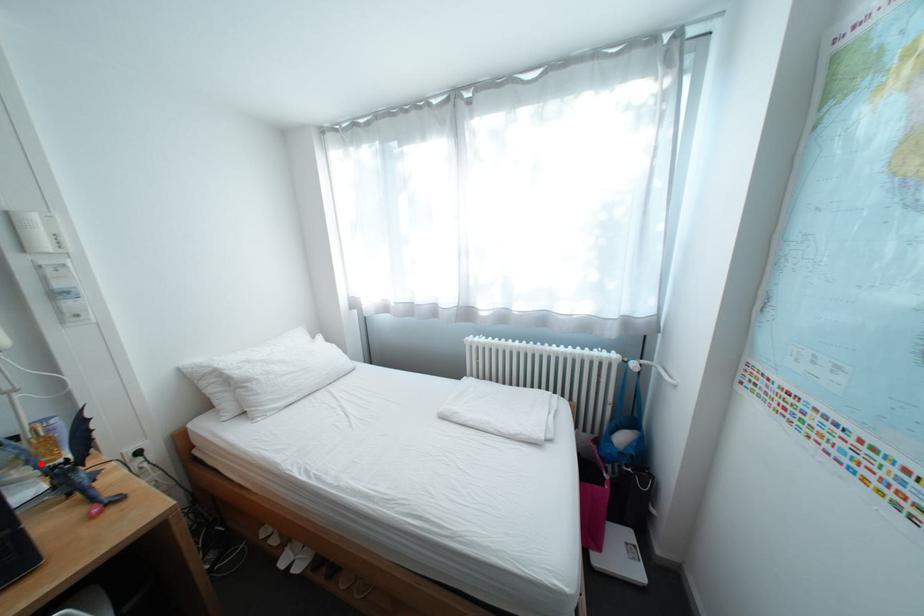
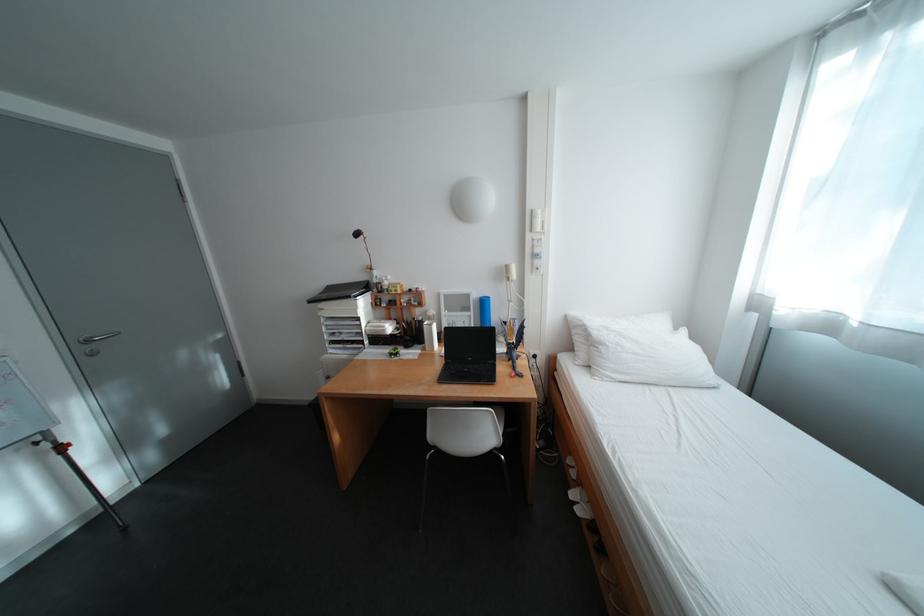
Find the pixel in the second image that matches the highlighted location in the first image.

(517, 338)